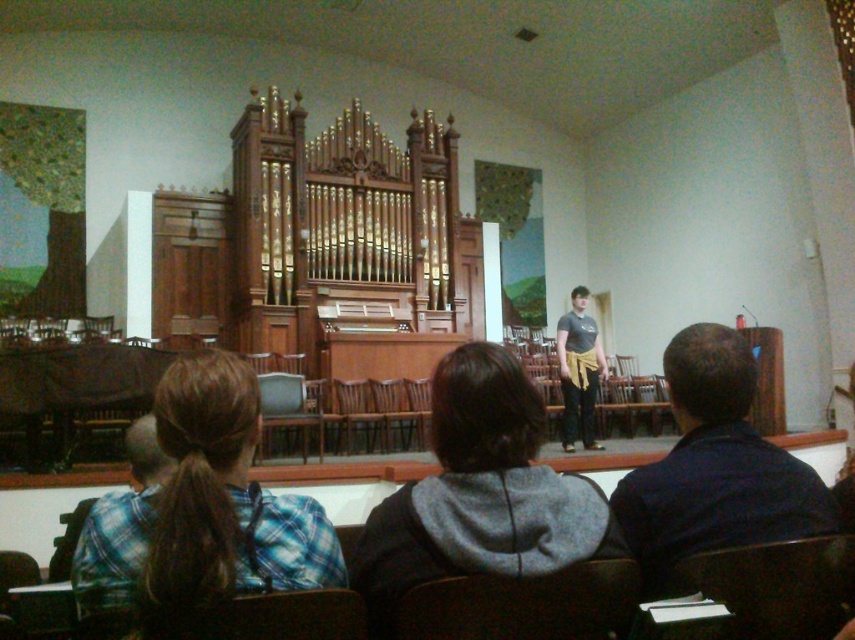
Question: Is gray fleece hoodie at center in front of dark gray t-shirt at center?

Choices:
 (A) no
 (B) yes

Answer: (B)

Question: Is gray fleece hoodie at center positioned at the back of dark gray t-shirt at center?

Choices:
 (A) yes
 (B) no

Answer: (B)

Question: Which object is farther from the camera taking this photo?

Choices:
 (A) dark blue shirt at center
 (B) plaid fabric shirt at lower left
 (C) gray fleece hoodie at center
 (D) blue plaid shirt at center

Answer: (B)

Question: Which object is farther from the camera taking this photo?

Choices:
 (A) dark gray t-shirt at center
 (B) dark blue shirt at center
 (C) plaid fabric shirt at lower left

Answer: (A)

Question: Which of these objects is positioned closest to the brown leather chair at lower center?

Choices:
 (A) dark gray t-shirt at center
 (B) plaid fabric shirt at lower left
 (C) blue plaid shirt at center
 (D) gray fleece hoodie at center

Answer: (D)

Question: Does dark blue shirt at center have a smaller size compared to plaid fabric shirt at lower left?

Choices:
 (A) no
 (B) yes

Answer: (A)